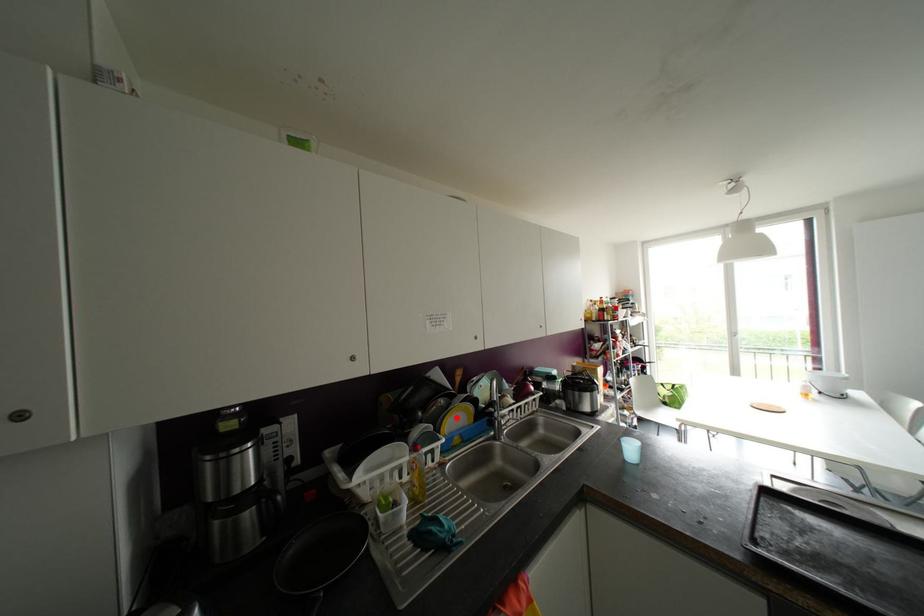
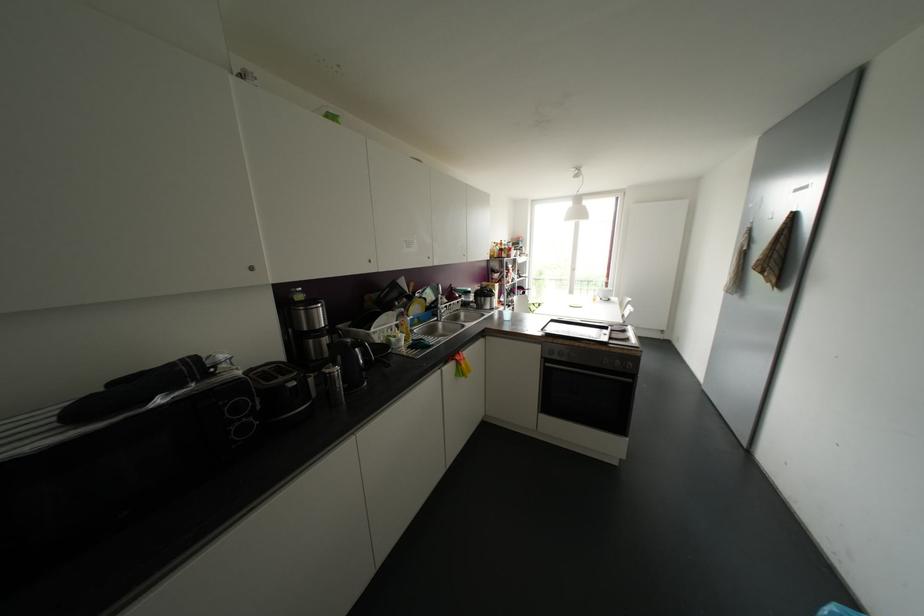
Find the pixel in the second image that matches the highlighted location in the first image.

(416, 307)